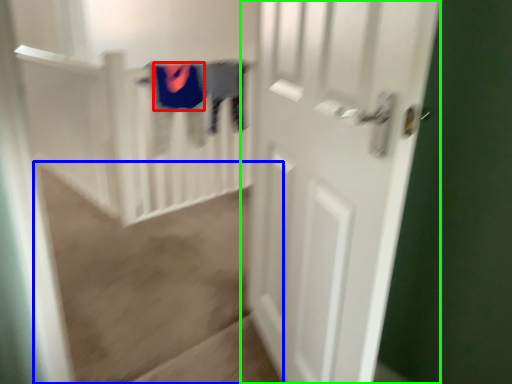
Question: Which object is positioned farthest from clothing (highlighted by a red box)? Select from plain (highlighted by a blue box) and door (highlighted by a green box).

Choices:
 (A) plain
 (B) door

Answer: (B)